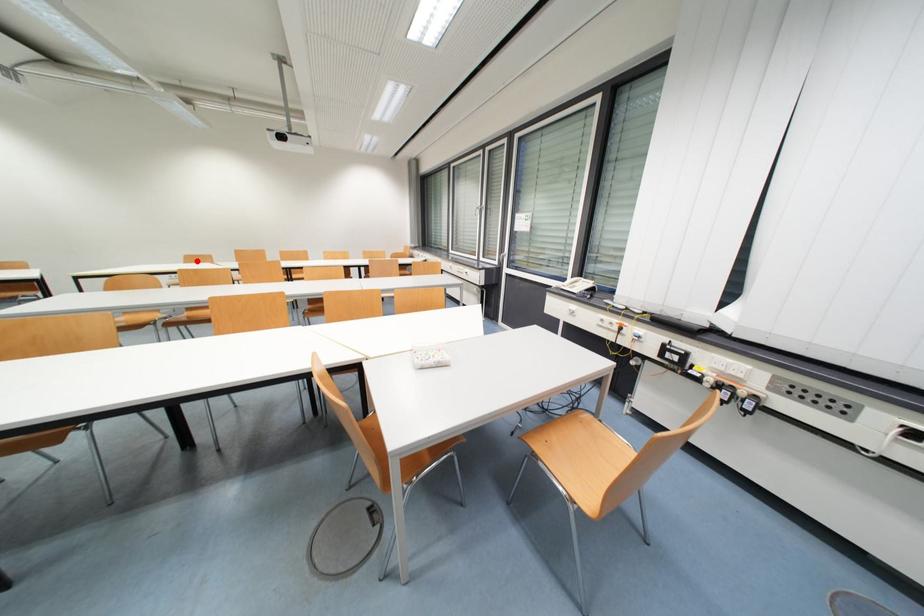
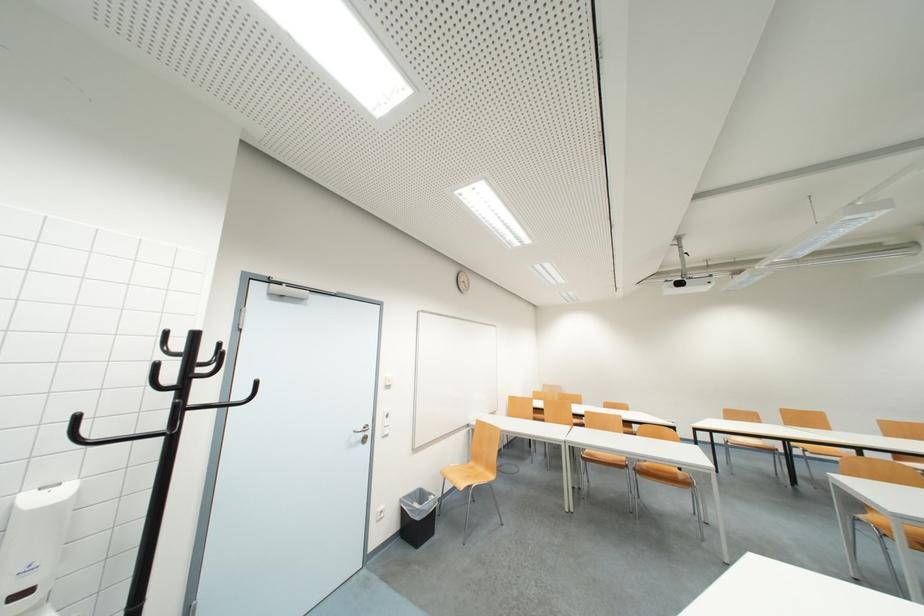
The point at the highlighted location is marked in the first image. Where is the corresponding point in the second image?

(736, 416)